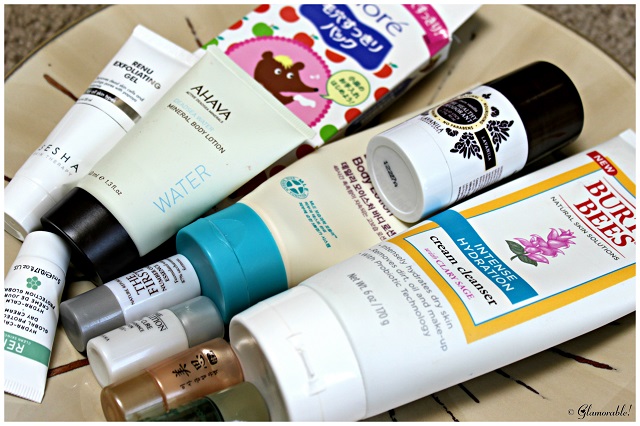
At what (x,y) coordinates should I click in order to perform the action: click on blurred granite countertop background. Please return your answer as a coordinate pair (x, y). This screenshot has width=640, height=426. Looking at the image, I should click on (32, 22), (602, 27).